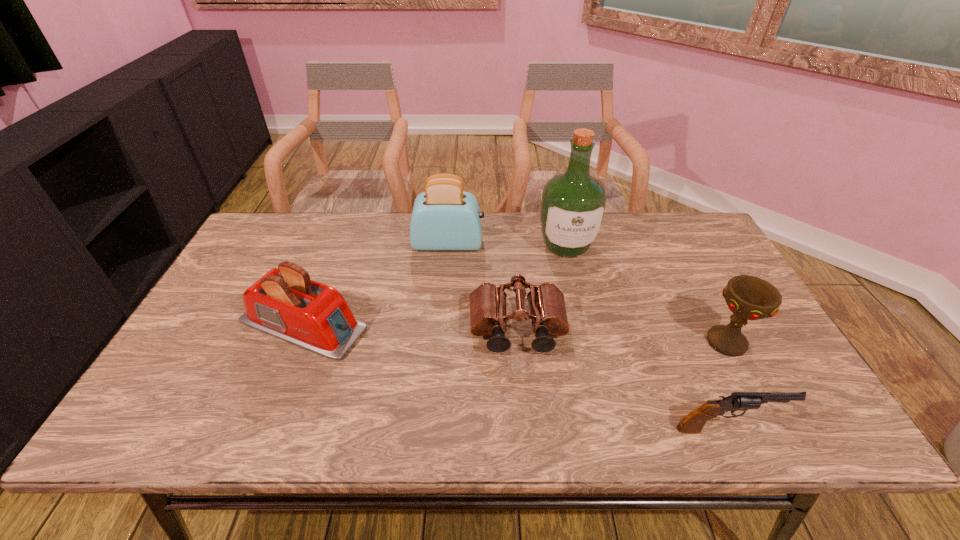
I want to click on object that is at the near right corner, so click(x=692, y=423).

This screenshot has height=540, width=960. I want to click on vacant area at the far edge of the desktop, so click(511, 248).

Locate an element on the screen. vacant area at the near edge is located at coordinates 547,441.

This screenshot has height=540, width=960. I want to click on vacant space at the left edge of the desktop, so click(x=220, y=300).

This screenshot has width=960, height=540. In the image, there is a desktop. What are the coordinates of `vacant space at the right edge` in the screenshot? It's located at (685, 291).

Where is `free region at the far right corner of the desktop`? This screenshot has width=960, height=540. free region at the far right corner of the desktop is located at coordinates (684, 247).

Locate an element on the screen. This screenshot has height=540, width=960. blank space at the near right corner of the desktop is located at coordinates (823, 421).

You are a GUI agent. You are given a task and a screenshot of the screen. Output one action in this format:
    pyautogui.click(x=<x>, y=<y>)
    Task: Click on the vacant space that is in between the chalice and the liquor
    
    Given the screenshot: What is the action you would take?
    pyautogui.click(x=647, y=294)

Find the location of a particular element. The width and height of the screenshot is (960, 540). empty space between the nearer toaster and the nearest object is located at coordinates (516, 376).

Identify the location of unoccupied position between the fifth shortest object and the gun. The height and width of the screenshot is (540, 960). (588, 336).